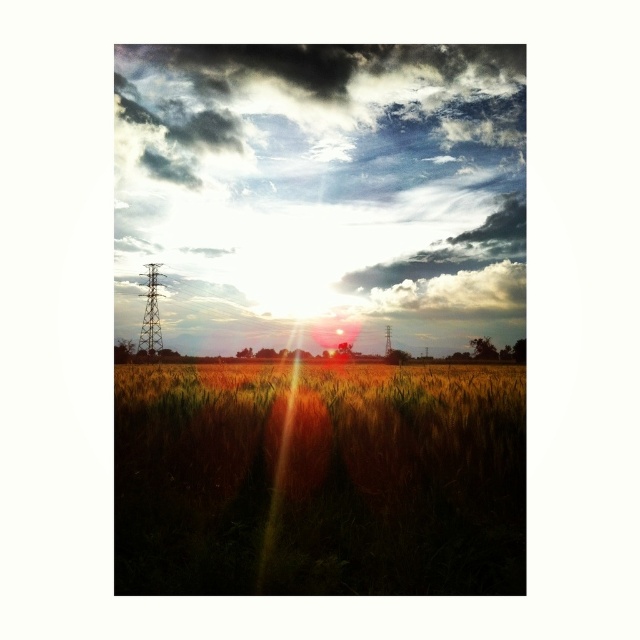
Question: Which point appears farthest from the camera in this image?

Choices:
 (A) (156, 45)
 (B) (428, 460)

Answer: (A)

Question: Does cloudy sky at upper center have a smaller size compared to golden grass at center?

Choices:
 (A) yes
 (B) no

Answer: (B)

Question: Is cloudy sky at upper center smaller than golden grass at center?

Choices:
 (A) yes
 (B) no

Answer: (B)

Question: Observing the image, what is the correct spatial positioning of cloudy sky at upper center in reference to golden grass at center?

Choices:
 (A) right
 (B) left

Answer: (B)